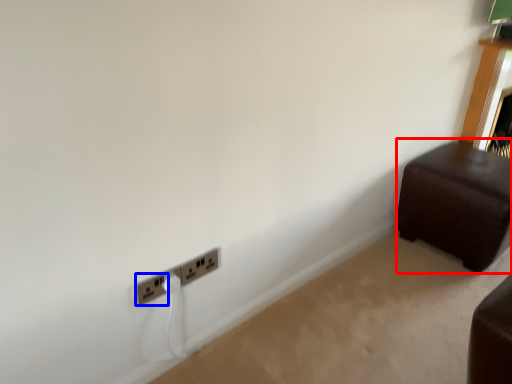
Question: Which object is closer to the camera taking this photo, furniture (highlighted by a red box) or power plugs and sockets (highlighted by a blue box)?

Choices:
 (A) furniture
 (B) power plugs and sockets

Answer: (B)